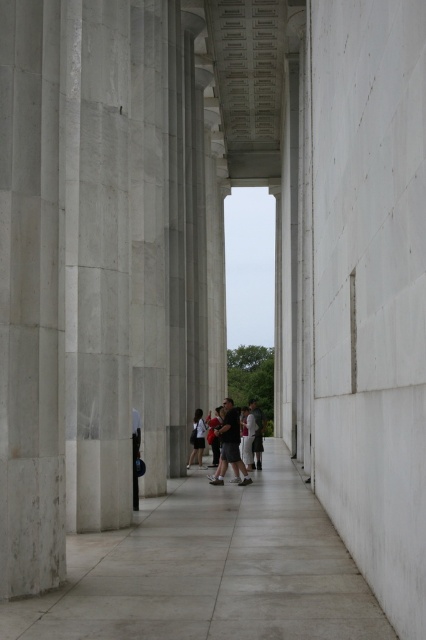
You are a photographer standing at the entrance of the colonnade. You want to capture a wide shot of the gray concrete pavement at center and the dark gray fabric pants at center in the same frame. Which object should you focus on first to ensure both are in focus?

The gray concrete pavement at center is wider than the dark gray fabric pants at center, so focusing on the gray concrete pavement at center first will help ensure both are in focus since it occupies more space in the frame.

Based on the photo, you are standing at the entrance of the colonnade and notice both the gray concrete pavement at center and the dark gray fabric jacket at center. Which object is closer to the ground level?

The gray concrete pavement at center is closer to the ground level since it has a lesser height compared to the dark gray fabric jacket at center.

You are standing at the entrance of the colonnade and want to locate the person wearing dark gray fabric pants at center. According to the coordinate system where the bottom left corner is the origin, can you determine if the person is closer to the left or right side of the colonnade?

The dark gray fabric pants at center is located at coordinate point 0.695 on the x axis, which indicates it is closer to the right side of the colonnade.